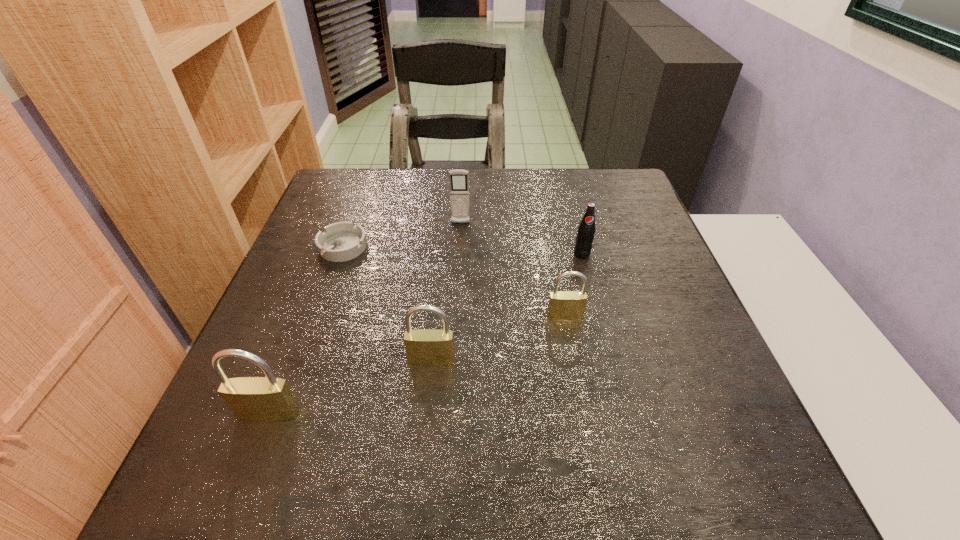
You are a GUI agent. You are given a task and a screenshot of the screen. Output one action in this format:
    pyautogui.click(x=<x>, y=<y>)
    Task: Click on the vacant area situated on the front-facing side of the farthest padlock
    
    Given the screenshot: What is the action you would take?
    pyautogui.click(x=581, y=401)

Where is `vacant space located on the front-facing side of the farthest object`? The width and height of the screenshot is (960, 540). vacant space located on the front-facing side of the farthest object is located at coordinates (455, 325).

You are a GUI agent. You are given a task and a screenshot of the screen. Output one action in this format:
    pyautogui.click(x=<x>, y=<y>)
    Task: Click on the vacant region located on the front of the ashtray
    This screenshot has height=540, width=960.
    Given the screenshot: What is the action you would take?
    pyautogui.click(x=304, y=355)

This screenshot has width=960, height=540. I want to click on free space located on the front label of the pop, so click(602, 330).

The height and width of the screenshot is (540, 960). Find the location of `object situated at the near edge`. object situated at the near edge is located at coordinates (252, 399).

I want to click on padlock at the left edge, so click(x=252, y=399).

Identify the location of ashtray present at the left edge. This screenshot has width=960, height=540. tap(342, 241).

The width and height of the screenshot is (960, 540). What are the coordinates of `object that is positioned at the near left corner` in the screenshot? It's located at [252, 399].

Identify the location of vacant area at the far edge of the desktop. This screenshot has height=540, width=960. (488, 171).

This screenshot has height=540, width=960. I want to click on vacant space at the near edge, so 631,431.